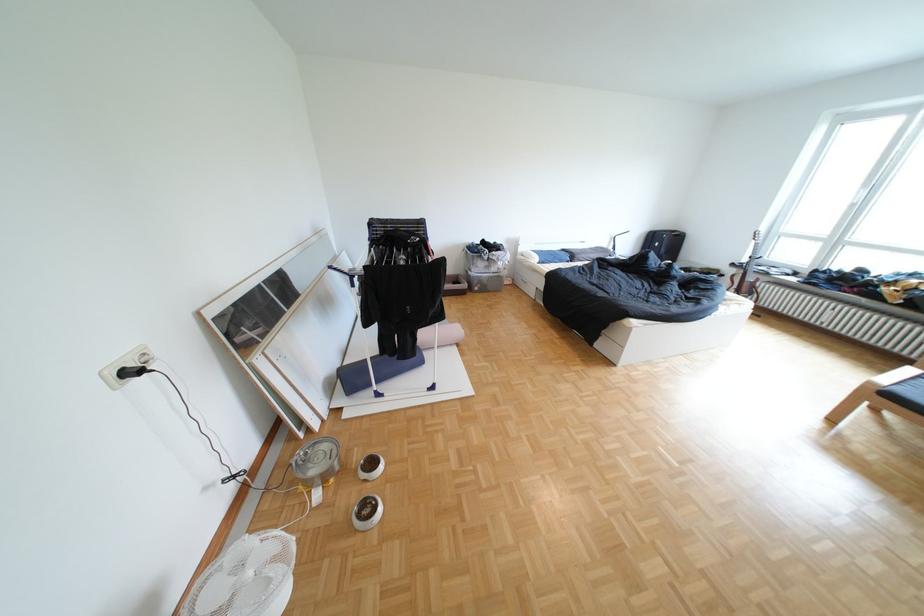
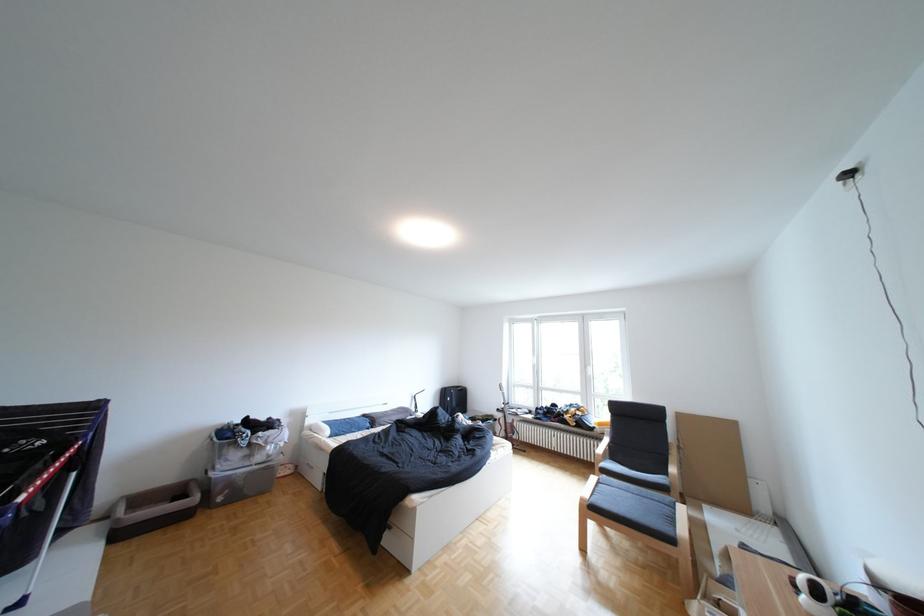
Where in the second image is the point corresponding to (x=505, y=252) from the first image?

(270, 434)